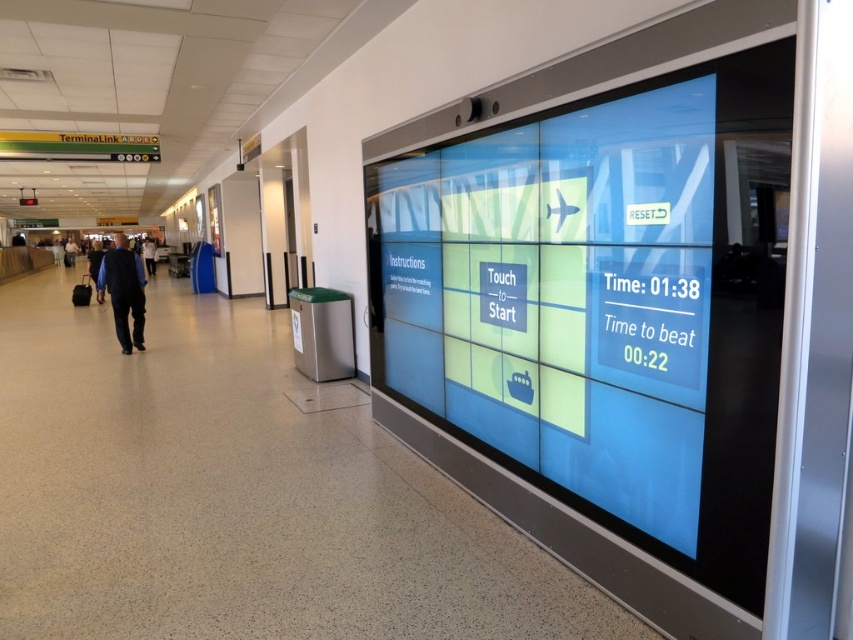
Does dark blue suit at left have a greater height compared to black suit at left?

Yes.

Is dark blue suit at left in front of black suit at left?

Yes, it is in front of black suit at left.

Who is more forward, (97, 278) or (64, 248)?

Point (97, 278)

Where is `dark blue suit at left`? The height and width of the screenshot is (640, 853). dark blue suit at left is located at coordinates (123, 291).

Can you confirm if blue glossy screen at right is thinner than dark blue suit at left?

In fact, blue glossy screen at right might be wider than dark blue suit at left.

Is blue glossy screen at right wider than dark blue suit at left?

Indeed, blue glossy screen at right has a greater width compared to dark blue suit at left.

Where is `blue glossy screen at right`? blue glossy screen at right is located at coordinates [x=605, y=304].

Can you confirm if blue glossy screen at right is positioned below black suit at left?

Correct, blue glossy screen at right is located below black suit at left.

Which is more to the right, blue glossy screen at right or black suit at left?

blue glossy screen at right

The image size is (853, 640). In order to click on blue glossy screen at right in this screenshot , I will do `click(605, 304)`.

Find the location of a particular element. This screenshot has width=853, height=640. blue glossy screen at right is located at coordinates pos(605,304).